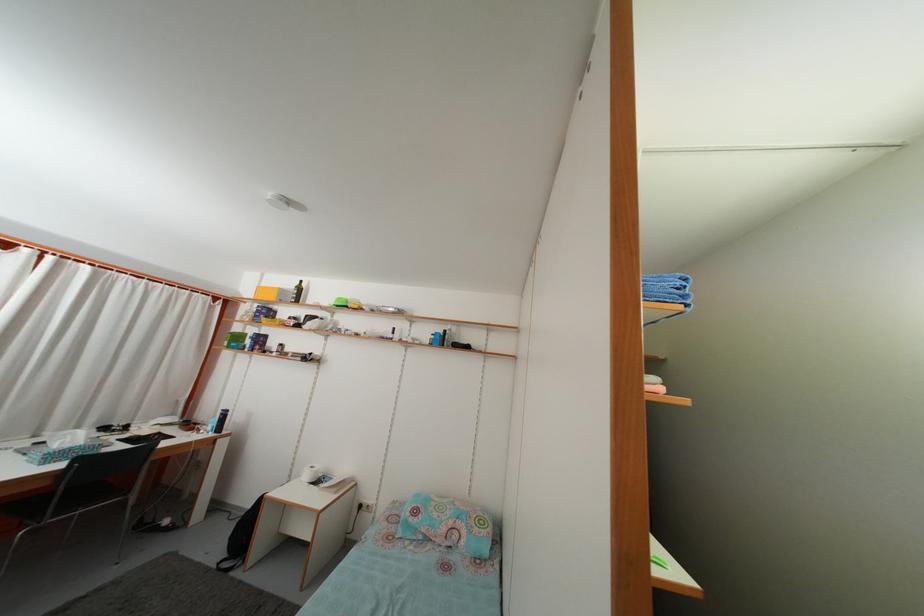
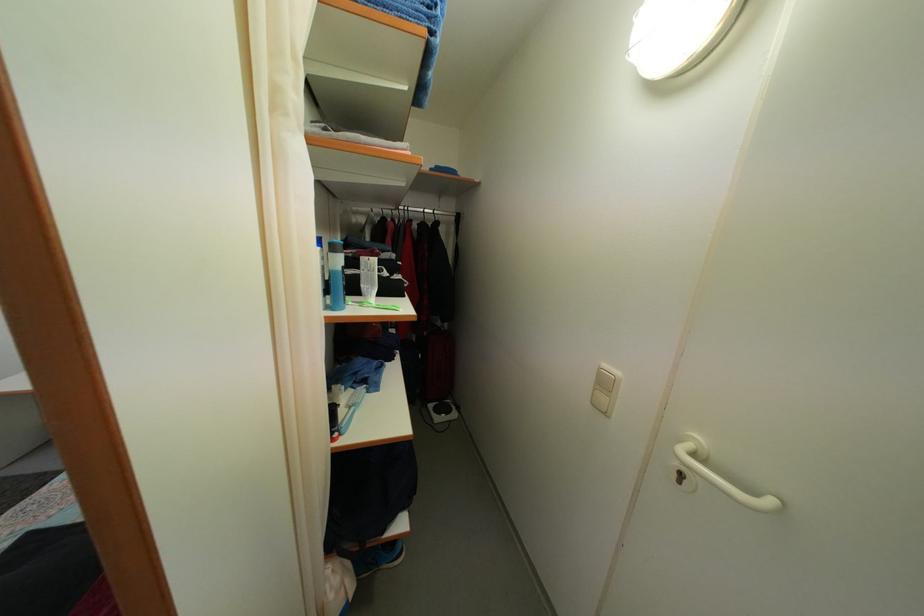
Based on the photo, first-person continuous shooting, in which direction is the camera rotating?

The camera rotated toward right-down.